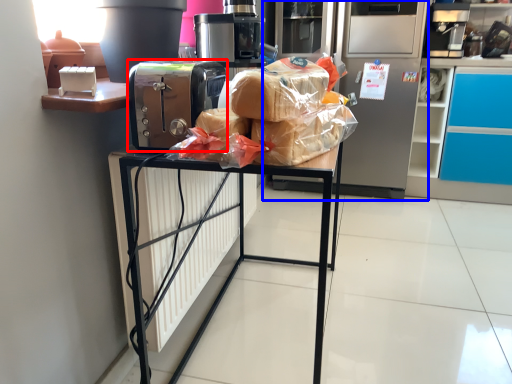
Question: Which object is closer to the camera taking this photo, home appliance (highlighted by a red box) or appliance (highlighted by a blue box)?

Choices:
 (A) home appliance
 (B) appliance

Answer: (A)